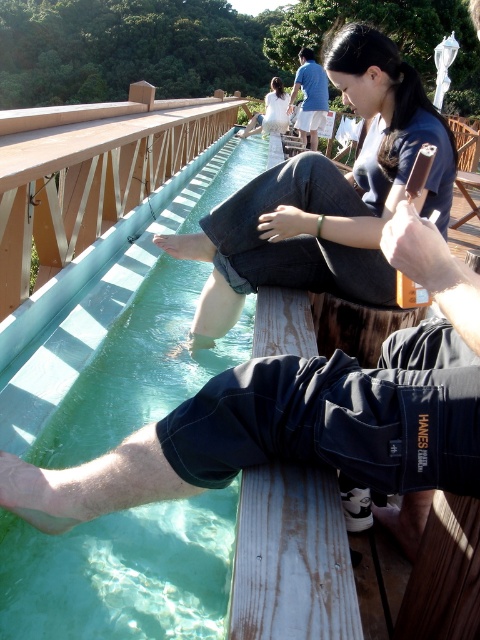
Between clear glass water at center and blue cotton shirt at upper center, which one appears on the right side from the viewer's perspective?

Positioned to the right is blue cotton shirt at upper center.

This screenshot has width=480, height=640. Describe the element at coordinates (139, 333) in the screenshot. I see `clear glass water at center` at that location.

Locate an element on the screen. The width and height of the screenshot is (480, 640). clear glass water at center is located at coordinates (139, 333).

Who is more forward, (88, 428) or (451, 168)?

Point (451, 168)

Which is more to the right, clear glass water at center or denim jeans at center?

From the viewer's perspective, denim jeans at center appears more on the right side.

This screenshot has width=480, height=640. What do you see at coordinates (139, 333) in the screenshot?
I see `clear glass water at center` at bounding box center [139, 333].

Locate an element on the screen. Image resolution: width=480 pixels, height=640 pixels. clear glass water at center is located at coordinates (139, 333).

Is denim jeans at center wider than blue cotton shirt at upper center?

Indeed, denim jeans at center has a greater width compared to blue cotton shirt at upper center.

Does denim jeans at center have a smaller size compared to blue cotton shirt at upper center?

Correct, denim jeans at center occupies less space than blue cotton shirt at upper center.

You are a GUI agent. You are given a task and a screenshot of the screen. Output one action in this format:
    pyautogui.click(x=<x>, y=<y>)
    Task: Click on the denim jeans at center
    This screenshot has height=640, width=480.
    Given the screenshot: What is the action you would take?
    pyautogui.click(x=326, y=196)